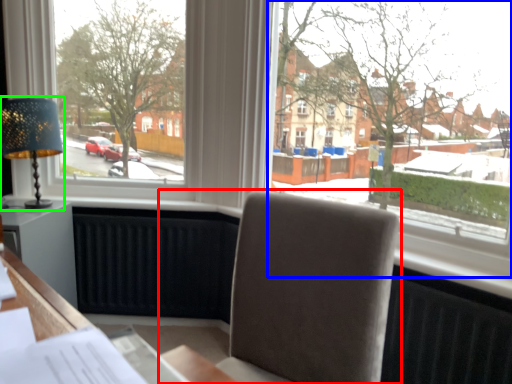
Question: Which object is positioned farthest from chair (highlighted by a red box)? Select from window (highlighted by a blue box) and table lamp (highlighted by a green box).

Choices:
 (A) window
 (B) table lamp

Answer: (B)